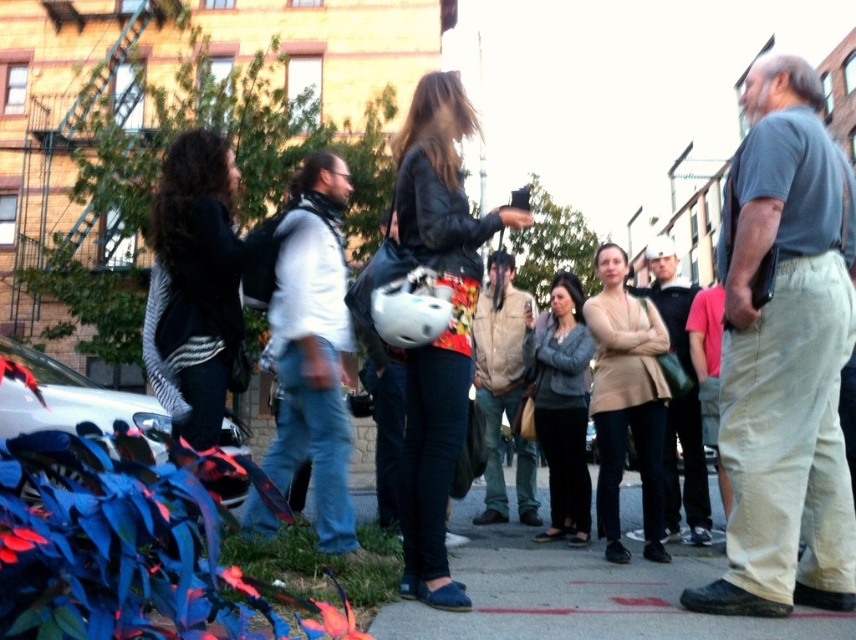
Is point (776, 291) closer to camera compared to point (625, 380)?

That is True.

Is gray cotton shirt at right to the right of beige textured sweater at center from the viewer's perspective?

Correct, you'll find gray cotton shirt at right to the right of beige textured sweater at center.

Does point (854, 598) come in front of point (634, 371)?

Yes, it is in front of point (634, 371).

Identify the location of gray cotton shirt at right. (785, 355).

Who is more forward, (785, 490) or (495, 336)?

Point (785, 490) is more forward.

Between gray cotton shirt at right and tan suede jacket at center, which one is positioned lower?

tan suede jacket at center

Between point (800, 275) and point (504, 323), which one is positioned behind?

The point (504, 323) is behind.

The image size is (856, 640). I want to click on gray cotton shirt at right, so click(785, 355).

Who is positioned more to the right, gray knit sweater at center or light brown leather jacket at center?

light brown leather jacket at center is more to the right.

Is point (550, 292) behind point (667, 502)?

Yes, it is.

Who is more distant from viewer, (565, 292) or (675, 452)?

Positioned behind is point (565, 292).

Where is `gray knit sweater at center`? The height and width of the screenshot is (640, 856). gray knit sweater at center is located at coordinates (562, 406).